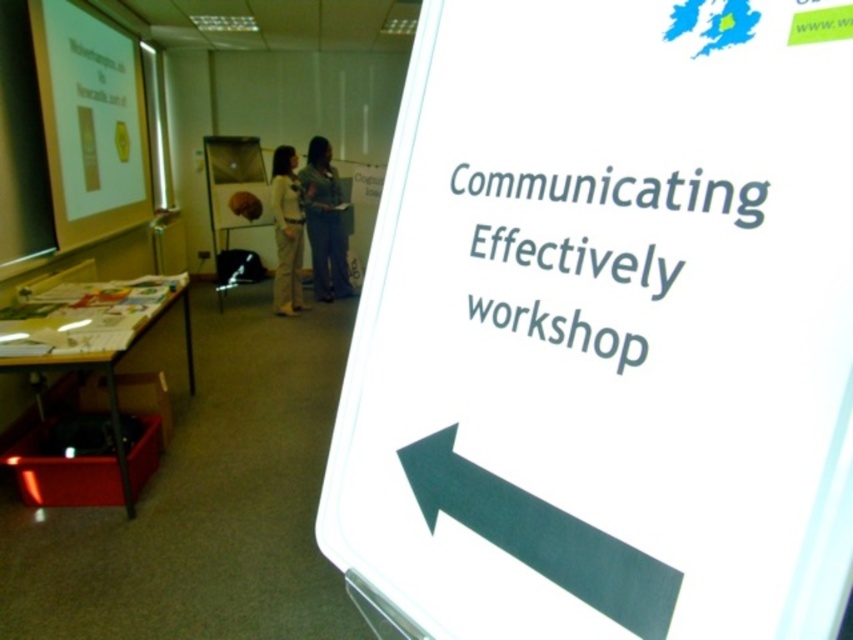
Does white paper sign at center appear on the right side of white glossy projector screen at upper left?

Yes, white paper sign at center is to the right of white glossy projector screen at upper left.

Can you confirm if white paper sign at center is positioned to the left of white glossy projector screen at upper left?

Incorrect, white paper sign at center is not on the left side of white glossy projector screen at upper left.

What do you see at coordinates (606, 328) in the screenshot? This screenshot has width=853, height=640. I see `white paper sign at center` at bounding box center [606, 328].

At what (x,y) coordinates should I click in order to perform the action: click on white paper sign at center. Please return your answer as a coordinate pair (x, y). Looking at the image, I should click on (606, 328).

Can you confirm if white glossy projector screen at upper left is positioned to the right of denim pants at center?

No, white glossy projector screen at upper left is not to the right of denim pants at center.

Who is more distant from viewer, (80, 38) or (326, 180)?

Positioned behind is point (326, 180).

Find the location of a particular element. white glossy projector screen at upper left is located at coordinates (90, 122).

Can you confirm if white glossy projector screen at upper left is thinner than green matte arrow at lower left?

No.

Is point (112, 93) positioned after point (518, 508)?

Yes, point (112, 93) is behind point (518, 508).

This screenshot has height=640, width=853. What are the coordinates of `white glossy projector screen at upper left` in the screenshot? It's located at (90, 122).